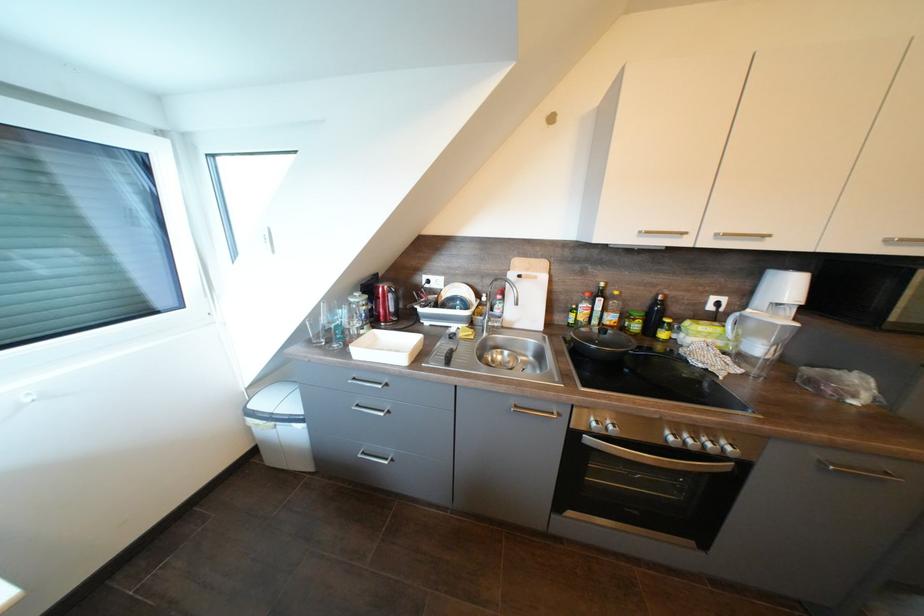
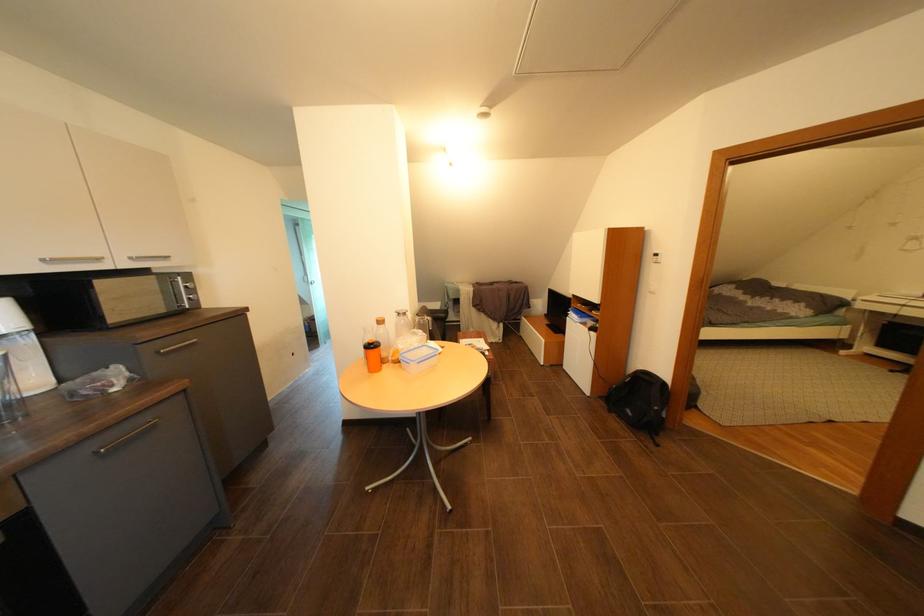
Based on the continuous images, in which direction is the camera rotating?

The rotation direction of the camera is right-down.